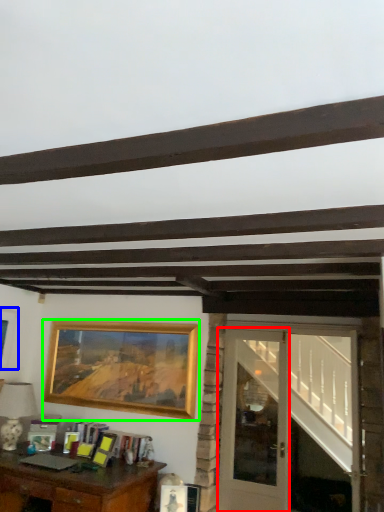
Question: Considering the real-world distances, which object is closest to glass door (highlighted by a red box)? picture frame (highlighted by a blue box) or picture frame (highlighted by a green box).

Choices:
 (A) picture frame
 (B) picture frame

Answer: (B)